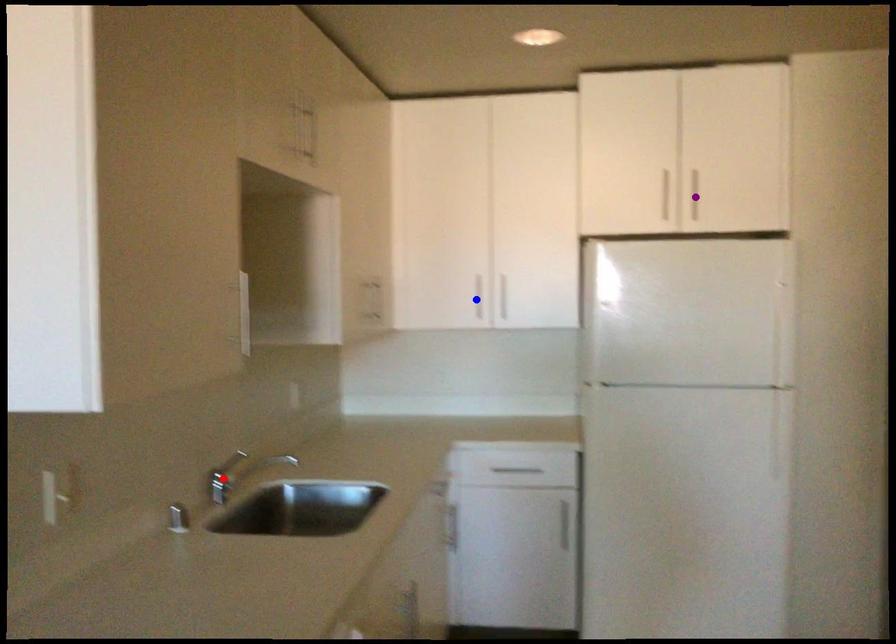
Order these from nearest to farthest:
- blue point
- red point
- purple point

blue point < purple point < red point